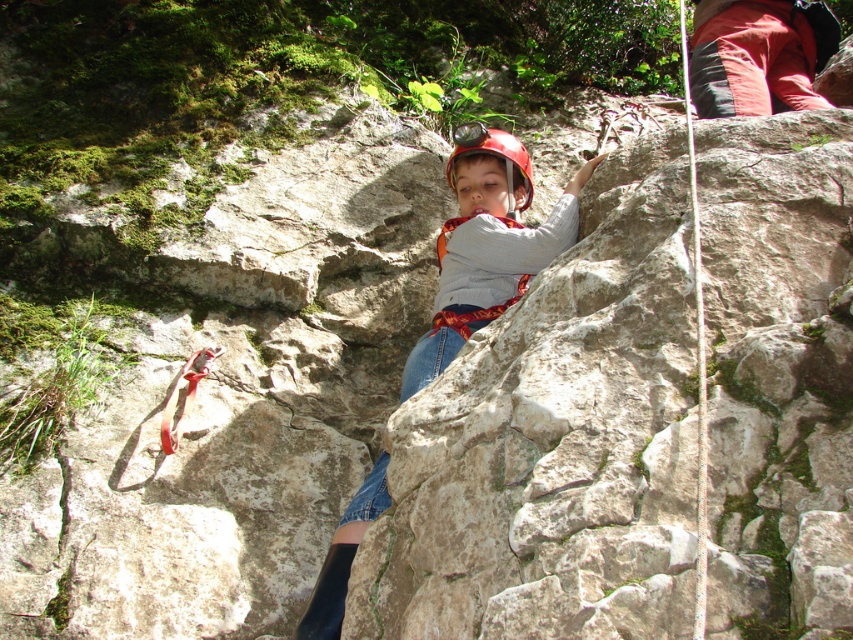
Question: Does matte gray helmet at center have a lesser width compared to white nylon rope at right?

Choices:
 (A) no
 (B) yes

Answer: (B)

Question: Is red fabric jacket at upper right in front of white nylon rope at right?

Choices:
 (A) no
 (B) yes

Answer: (A)

Question: Is white nylon rope at right in front of red matte helmet at center?

Choices:
 (A) no
 (B) yes

Answer: (B)

Question: Which point appears closest to the camera in this image?

Choices:
 (A) (753, 38)
 (B) (469, 189)
 (C) (680, 28)

Answer: (B)

Question: Based on their relative distances, which object is farther from the red matte helmet at center?

Choices:
 (A) white nylon rope at right
 (B) matte gray helmet at center

Answer: (A)

Question: Which point is closer to the camera?

Choices:
 (A) (699, 566)
 (B) (717, 49)
 (C) (488, 150)
 (D) (335, 572)

Answer: (A)